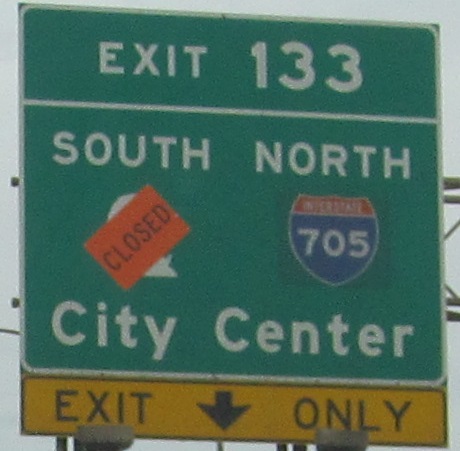
Image resolution: width=460 pixels, height=451 pixels. I want to click on lights, so click(x=352, y=438), click(x=102, y=438).